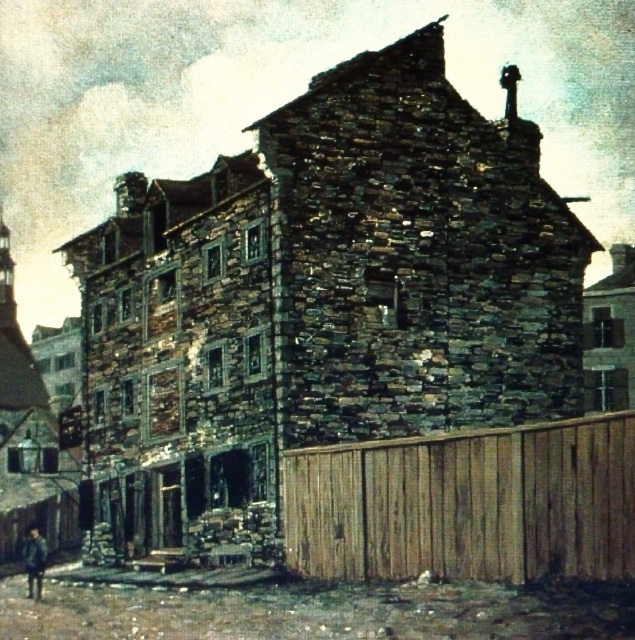
Which is below, brown wooden fence at right or dark blue jacket at lower left?

dark blue jacket at lower left is below.

Does brown wooden fence at right have a larger size compared to dark blue jacket at lower left?

Result: Indeed, brown wooden fence at right has a larger size compared to dark blue jacket at lower left.

I want to click on brown wooden fence at right, so click(x=465, y=502).